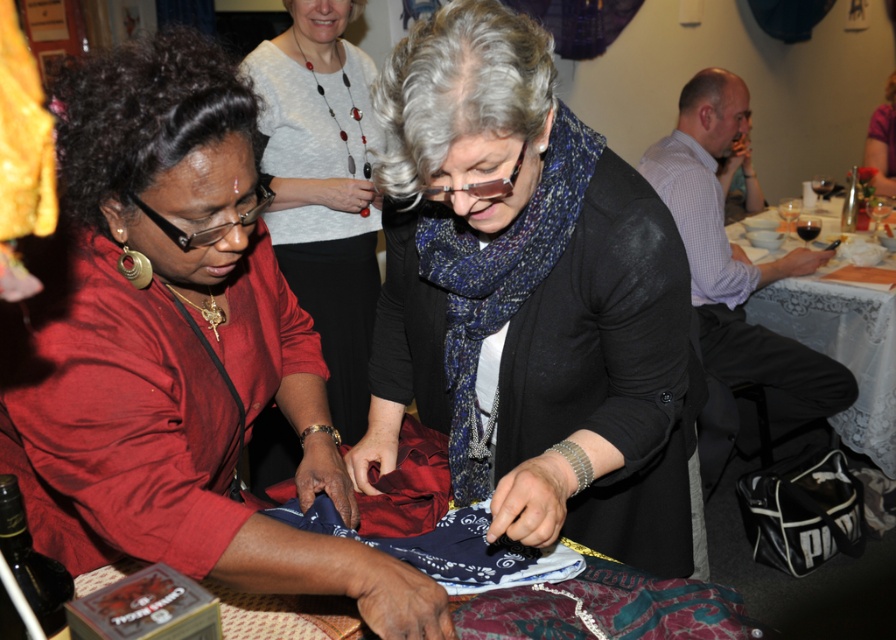
You are a guest at this event and want to place your drink on the table without it touching the blue knitted scarf at center. Is the dark red glass at center already positioned in a spot that doesn

The dark red glass at center is smaller than the blue knitted scarf at center, so it might be placed in a position that avoids touching the scarf. However, the exact placement isn

You are standing in the dining area and see two points marked on the floor. The first point is at coordinate point(x=39, y=300) and the second is at point(x=256, y=54). Which point is closer to you?

Point(x=39, y=300) is closer to the viewer than point(x=256, y=54).